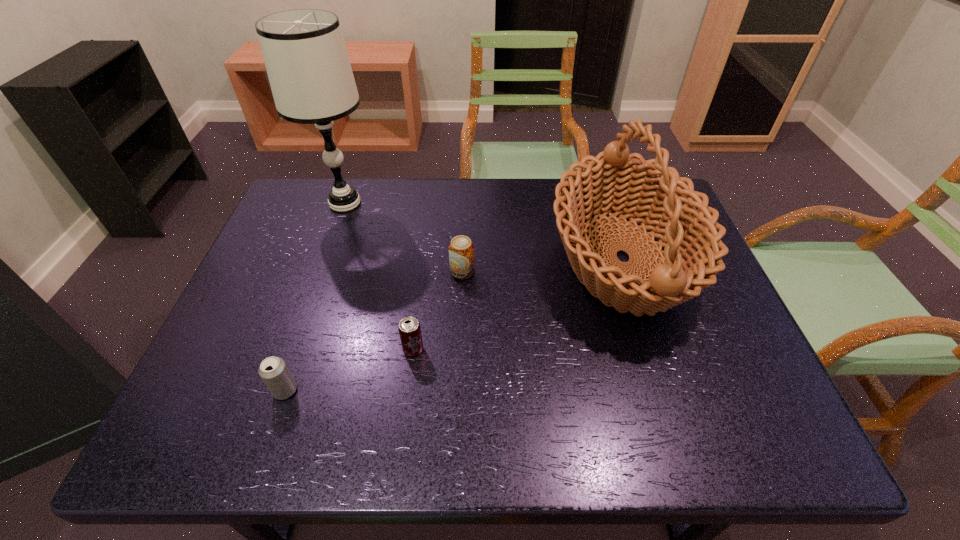
You are a GUI agent. You are given a task and a screenshot of the screen. Output one action in this format:
    pyautogui.click(x=<x>, y=<y>)
    Task: Click on the free space that is in between the rightmost object and the farthest beer can
    The height and width of the screenshot is (540, 960).
    Given the screenshot: What is the action you would take?
    pyautogui.click(x=542, y=265)

Identify the location of vacant point located between the rightmost object and the tallest object. (484, 231).

You are a GUI agent. You are given a task and a screenshot of the screen. Output one action in this format:
    pyautogui.click(x=<x>, y=<y>)
    Task: Click on the empty space between the basket and the second beer can from right to left
    The image size is (960, 540).
    Given the screenshot: What is the action you would take?
    pyautogui.click(x=517, y=304)

Locate an element on the screen. This screenshot has height=540, width=960. vacant space in between the tallest object and the second farthest beer can is located at coordinates (379, 276).

Identify the location of free space between the fourth object from left to right and the second tallest object. (542, 265).

Find the location of `empty space that is in between the second farthest beer can and the second object from right to left`. empty space that is in between the second farthest beer can and the second object from right to left is located at coordinates (438, 310).

You are a GUI agent. You are given a task and a screenshot of the screen. Output one action in this format:
    pyautogui.click(x=<x>, y=<y>)
    Task: Click on the third closest object to the rightmost beer can
    Image resolution: width=960 pixels, height=540 pixels.
    Given the screenshot: What is the action you would take?
    pyautogui.click(x=304, y=52)

The height and width of the screenshot is (540, 960). Find the location of `the closest object to the third object from right to left`. the closest object to the third object from right to left is located at coordinates (461, 250).

Locate which beer can is the second closest to the second nearest beer can. Please provide its 2D coordinates. Your answer should be formatted as a tuple, i.e. [(x, y)], where the tuple contains the x and y coordinates of a point satisfying the conditions above.

[(274, 372)]

I want to click on the closest beer can to the nearest object, so click(x=409, y=328).